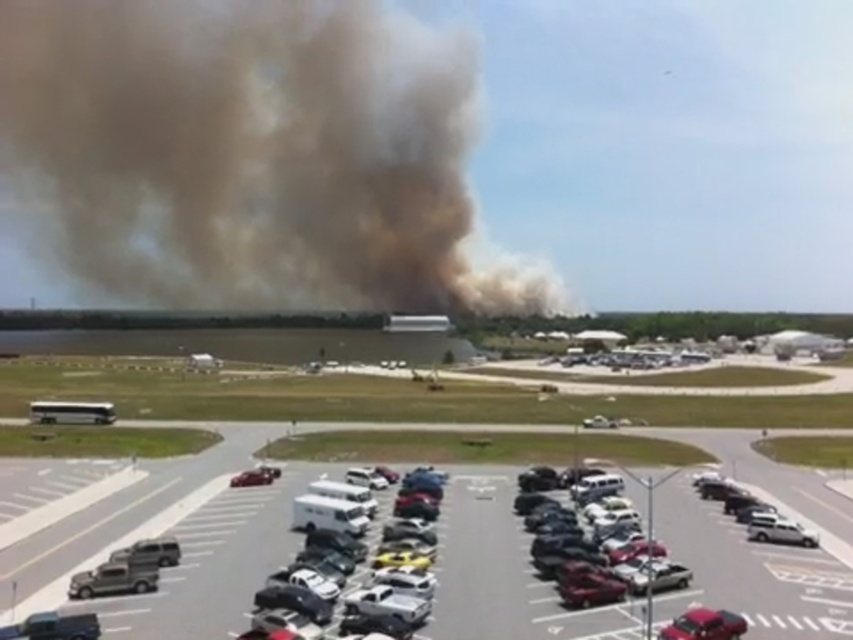
Between metallic silver car at center and satin black car at lower left, which one is positioned higher?

satin black car at lower left is above.

Which of these two, metallic silver car at center or satin black car at lower left, stands shorter?

satin black car at lower left is shorter.

Is point (421, 611) farther from camera compared to point (263, 476)?

That is False.

You are a GUI agent. You are given a task and a screenshot of the screen. Output one action in this format:
    pyautogui.click(x=<x>, y=<y>)
    Task: Click on the metallic silver car at center
    
    Given the screenshot: What is the action you would take?
    pyautogui.click(x=329, y=524)

Is point (604, 595) less distant than point (734, 612)?

That is False.

Can you confirm if metallic silver truck at lower right is positioned to the left of shiny red car at lower right?

In fact, metallic silver truck at lower right is to the right of shiny red car at lower right.

Which is behind, point (625, 592) or point (677, 630)?

Positioned behind is point (625, 592).

Image resolution: width=853 pixels, height=640 pixels. Identify the location of metallic silver truck at lower right. (590, 586).

Which is above, brown dusty cloud at upper left or metallic silver car at center?

brown dusty cloud at upper left

Is point (368, 77) farther from camera compared to point (416, 598)?

Yes.

Where is `brown dusty cloud at upper left`? The height and width of the screenshot is (640, 853). brown dusty cloud at upper left is located at coordinates (252, 156).